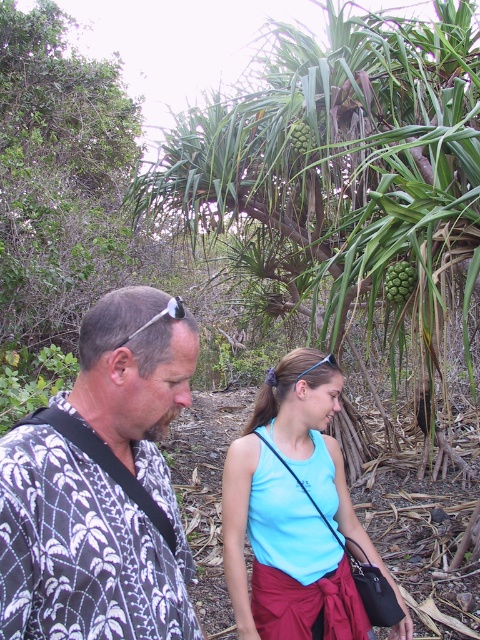
Question: Is printed fabric shirt at left to the right of light blue fabric tank top at center from the viewer's perspective?

Choices:
 (A) yes
 (B) no

Answer: (B)

Question: Which object is closer to the camera taking this photo?

Choices:
 (A) light blue fabric tank top at center
 (B) printed fabric shirt at left
 (C) green leafy tree at center

Answer: (B)

Question: Which point is closer to the camera?

Choices:
 (A) (261, 625)
 (B) (166, 339)
 (C) (324, 140)

Answer: (B)

Question: Does printed fabric shirt at left appear on the right side of light blue fabric tank top at center?

Choices:
 (A) yes
 (B) no

Answer: (B)

Question: Estimate the real-world distances between objects in this image. Which object is farther from the light blue fabric tank top at center?

Choices:
 (A) printed fabric shirt at left
 (B) green leafy tree at center

Answer: (B)

Question: Can you confirm if printed fabric shirt at left is positioned to the right of light blue fabric tank top at center?

Choices:
 (A) no
 (B) yes

Answer: (A)